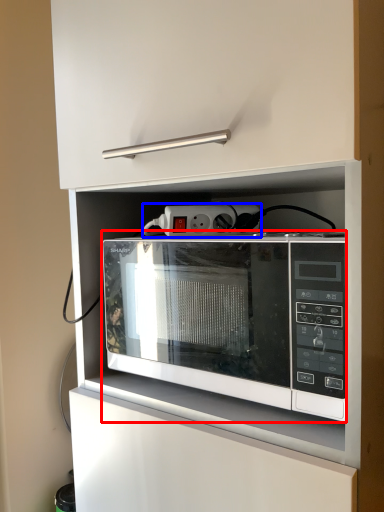
Question: Which of the following is the closest to the observer, microwave oven (highlighted by a red box) or electric outlet (highlighted by a blue box)?

Choices:
 (A) microwave oven
 (B) electric outlet

Answer: (A)